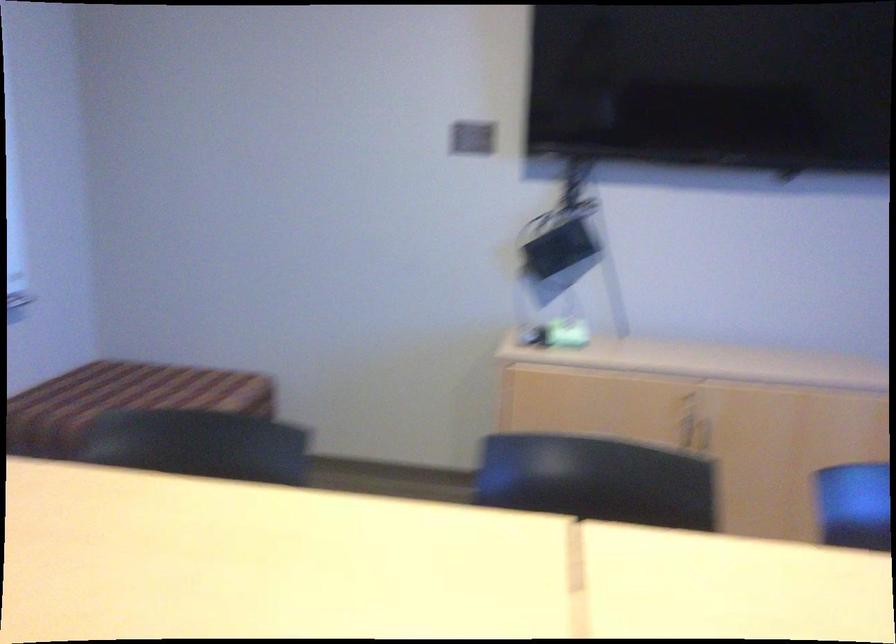
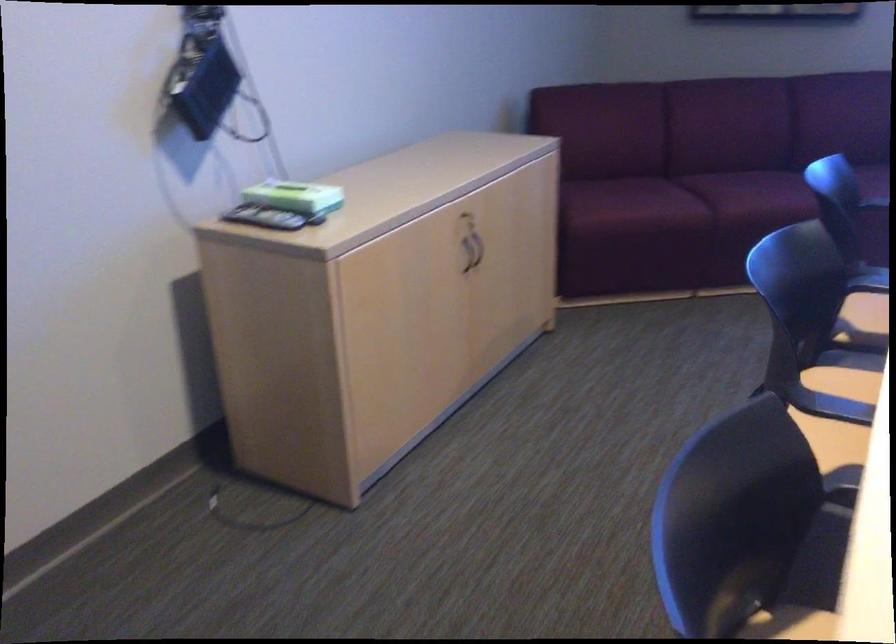
Find the pixel in the second image that matches [690,357] in the first image.

(428, 175)